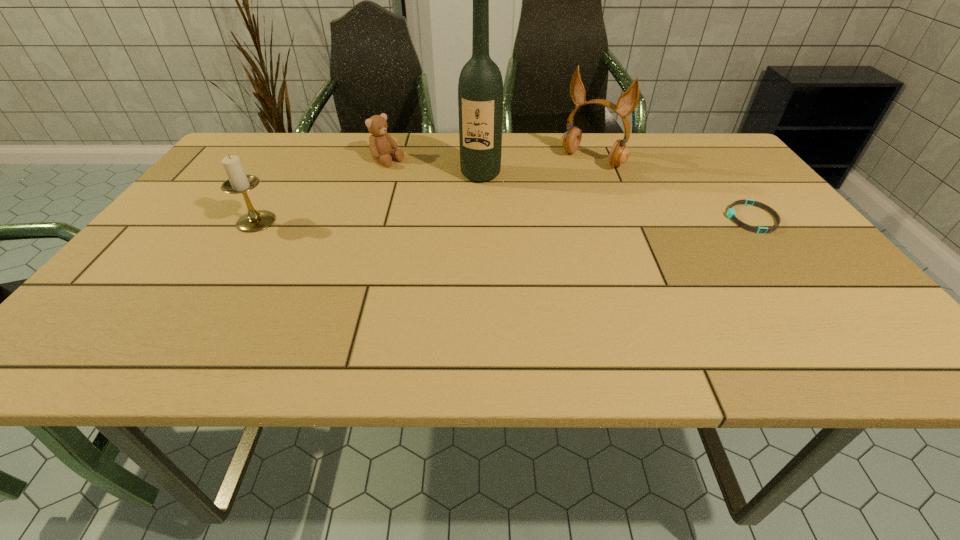
In order to click on the third shortest object in this screenshot , I will do 238,182.

Where is `candle holder`? candle holder is located at coordinates (238, 182).

Find the location of `the shortest object`. the shortest object is located at coordinates (731, 214).

The image size is (960, 540). Identify the location of wristband. (731, 214).

The height and width of the screenshot is (540, 960). Find the location of `the second object from left to right`. the second object from left to right is located at coordinates (382, 146).

Find the location of a particular element. The image size is (960, 540). the second shortest object is located at coordinates (382, 146).

Where is `the fourth object from left to right`? This screenshot has height=540, width=960. the fourth object from left to right is located at coordinates (627, 102).

Locate an element on the screen. The height and width of the screenshot is (540, 960). earphone is located at coordinates (627, 102).

Where is `the third object from right to left`? the third object from right to left is located at coordinates (480, 88).

You are a GUI agent. You are given a task and a screenshot of the screen. Output one action in this format:
    pyautogui.click(x=<x>, y=<y>)
    Task: Click on the tallest object
    The height and width of the screenshot is (540, 960).
    Given the screenshot: What is the action you would take?
    (x=480, y=88)